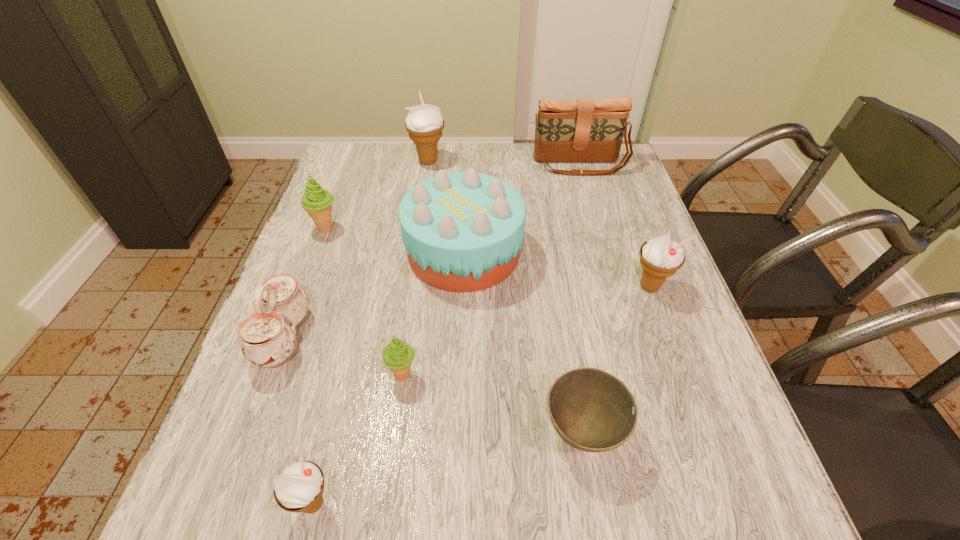
The image size is (960, 540). Find the location of `free point between the second biggest white icecream and the eighth farthest object`. free point between the second biggest white icecream and the eighth farthest object is located at coordinates (616, 359).

Locate an element on the screen. The height and width of the screenshot is (540, 960). blank region between the white chinaware and the cake is located at coordinates (374, 294).

Identify the location of free space that is in between the leftmost white icecream and the farther green icecream. (320, 366).

Where is `free area in between the smallest white icecream and the cake`? This screenshot has height=540, width=960. free area in between the smallest white icecream and the cake is located at coordinates (389, 377).

Where is `vacant point located between the bowl and the leftmost icecream`? vacant point located between the bowl and the leftmost icecream is located at coordinates (455, 329).

The height and width of the screenshot is (540, 960). Identify the location of empty location between the rightmost white icecream and the right green icecream. (526, 330).

Find the location of a particular element. The height and width of the screenshot is (540, 960). unoccupied position between the third nearest icecream and the chinaware is located at coordinates (467, 312).

Locate an element on the screen. free space between the smaller green icecream and the third object from left to right is located at coordinates (358, 439).

Where is `unoccupied area between the rightmost icecream and the bowl`? The height and width of the screenshot is (540, 960). unoccupied area between the rightmost icecream and the bowl is located at coordinates (616, 359).

Identify which object is the fifth nearest to the white chinaware. Please provide its 2D coordinates. Your answer should be formatted as a tuple, i.e. [(x, y)], where the tuple contains the x and y coordinates of a point satisfying the conditions above.

[(593, 411)]